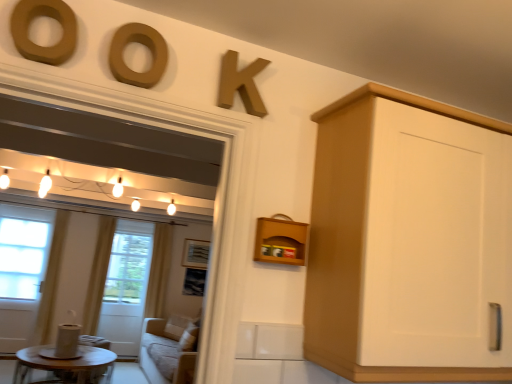
Question: Considering their positions, is white fabric curtain at left, acting as the 3th curtain starting from the right, located in front of or behind white sheer curtain at left, the second curtain positioned from the right?

Choices:
 (A) front
 (B) behind

Answer: (A)

Question: Looking at their shapes, would you say white fabric curtain at left, acting as the 3th curtain starting from the right, is wider or thinner than white sheer curtain at left, the second curtain positioned from the right?

Choices:
 (A) wide
 (B) thin

Answer: (A)

Question: Estimate the real-world distances between objects in this image. Which object is closer to the matte wood letter at upper center, the second oval from the left?

Choices:
 (A) white fabric curtain at left, acting as the 3th curtain starting from the right
 (B) wooden picture frame at center
 (C) yellow fabric curtain at left, the first curtain positioned from the right
 (D) matte brown letter o at upper left, which is the 1th oval from left to right
 (E) white matte cabinet at right

Answer: (D)

Question: Considering the real-world distances, which object is closest to the white sheer curtain at left, which is the 2th curtain in left-to-right order?

Choices:
 (A) wooden picture frame at center
 (B) matte wood letter at upper center, the second oval from the left
 (C) white matte cabinet at right
 (D) white fabric curtain at left, positioned as the first curtain in left-to-right order
 (E) matte brown letter o at upper left, which is the 1th oval from left to right

Answer: (D)